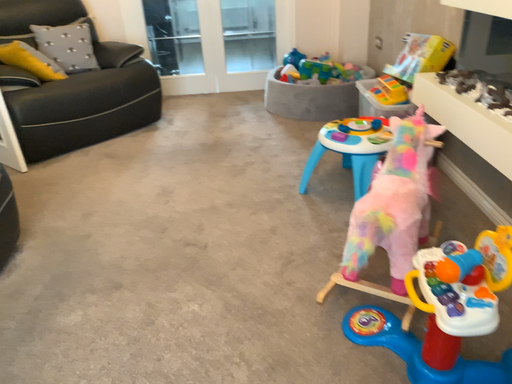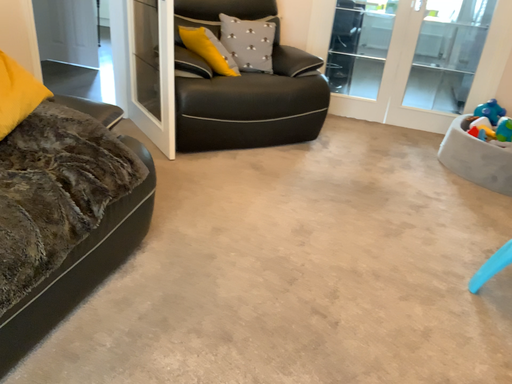
Question: How did the camera likely rotate when shooting the video?

Choices:
 (A) rotated right
 (B) rotated left

Answer: (B)